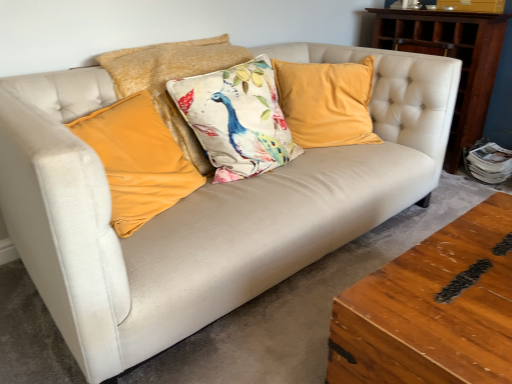
Question: From the image's perspective, is velvet yellow pillow at center, the fourth pillow positioned from the left, on top of wooden dresser at right?

Choices:
 (A) yes
 (B) no

Answer: (B)

Question: Is velvet yellow pillow at center, the fourth pillow positioned from the left, surrounding wooden dresser at right?

Choices:
 (A) yes
 (B) no

Answer: (B)

Question: From a real-world perspective, is velvet yellow pillow at center, the fourth pillow positioned from the left, located higher than wooden dresser at right?

Choices:
 (A) no
 (B) yes

Answer: (B)

Question: Is velvet yellow pillow at center, which is counted as the first pillow, starting from the right, outside wooden dresser at right?

Choices:
 (A) yes
 (B) no

Answer: (A)

Question: Can you confirm if velvet yellow pillow at center, the fourth pillow positioned from the left, is shorter than wooden dresser at right?

Choices:
 (A) no
 (B) yes

Answer: (B)

Question: From the image's perspective, relative to velvet mustard pillow at left, placed as the first pillow when sorted from left to right, is wooden dresser at right above or below?

Choices:
 (A) above
 (B) below

Answer: (A)

Question: Do you think wooden dresser at right is within velvet mustard pillow at left, the 4th pillow viewed from the right, or outside of it?

Choices:
 (A) outside
 (B) inside

Answer: (A)

Question: Based on their positions, is wooden dresser at right located to the left or right of velvet mustard pillow at left, placed as the first pillow when sorted from left to right?

Choices:
 (A) right
 (B) left

Answer: (A)

Question: In terms of size, does wooden dresser at right appear bigger or smaller than velvet mustard pillow at left, placed as the first pillow when sorted from left to right?

Choices:
 (A) big
 (B) small

Answer: (A)

Question: In terms of height, does velvet yellow pillow at center, the fourth pillow positioned from the left, look taller or shorter compared to wooden dresser at right?

Choices:
 (A) short
 (B) tall

Answer: (A)

Question: Visually, is velvet yellow pillow at center, the fourth pillow positioned from the left, positioned to the left or to the right of wooden dresser at right?

Choices:
 (A) right
 (B) left

Answer: (B)

Question: Is velvet yellow pillow at center, the fourth pillow positioned from the left, wider or thinner than wooden dresser at right?

Choices:
 (A) thin
 (B) wide

Answer: (A)

Question: Choose the correct answer: Is velvet yellow pillow at center, which is counted as the first pillow, starting from the right, inside wooden dresser at right or outside it?

Choices:
 (A) inside
 (B) outside

Answer: (B)

Question: Is velvet peacock pillow at center, the 3th pillow when ordered from left to right, taller or shorter than velvet mustard pillow at left, the 4th pillow viewed from the right?

Choices:
 (A) short
 (B) tall

Answer: (B)

Question: In the image, is velvet peacock pillow at center, the 3th pillow when ordered from left to right, on the left side or the right side of velvet mustard pillow at left, placed as the first pillow when sorted from left to right?

Choices:
 (A) right
 (B) left

Answer: (A)